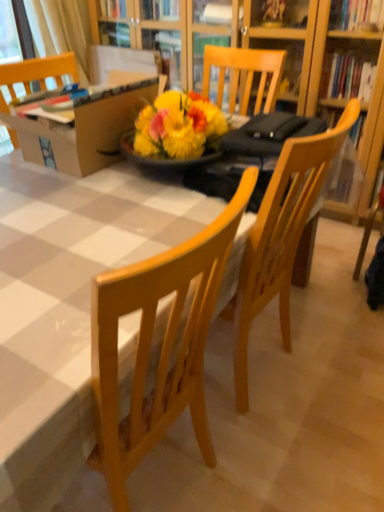
Question: Considering their positions, is cardboard box at upper left located in front of or behind wooden table at center?

Choices:
 (A) behind
 (B) front

Answer: (A)

Question: Considering the positions of cardboard box at upper left and wooden table at center in the image, is cardboard box at upper left wider or thinner than wooden table at center?

Choices:
 (A) thin
 (B) wide

Answer: (A)

Question: Which of these objects is positioned farthest from the cardboard box at upper left?

Choices:
 (A) white fabric curtain at upper left
 (B) wooden table at center

Answer: (A)

Question: Which object is positioned closest to the white fabric curtain at upper left?

Choices:
 (A) cardboard box at upper left
 (B) wooden table at center

Answer: (A)